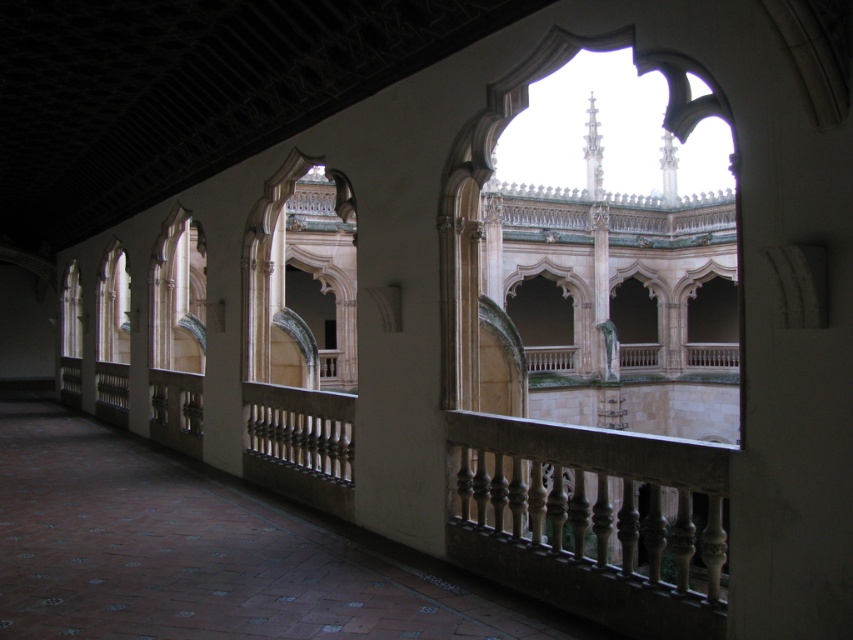
Question: Does matte glass window at center have a greater width compared to clear glass window at center?

Choices:
 (A) yes
 (B) no

Answer: (A)

Question: Which of the following is the closest to the observer?

Choices:
 (A) (73, 349)
 (B) (105, 344)

Answer: (B)

Question: Can you confirm if matte glass window at center is positioned below clear glass window at center?

Choices:
 (A) no
 (B) yes

Answer: (A)

Question: Is matte glass window at center to the left of clear glass window at center from the viewer's perspective?

Choices:
 (A) yes
 (B) no

Answer: (B)

Question: Which point is farther from the camera taking this photo?

Choices:
 (A) (123, 332)
 (B) (61, 346)

Answer: (B)